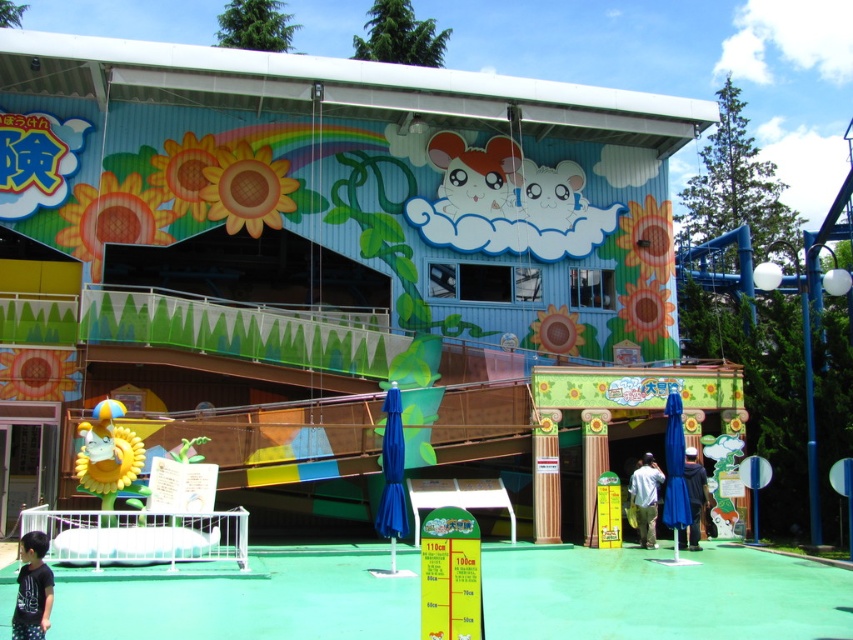
Question: Which point is closer to the camera taking this photo?

Choices:
 (A) click(28, 550)
 (B) click(637, 486)
 (C) click(695, 472)

Answer: (A)

Question: Is white fabric shirt at lower right wider than dark blue fabric jacket at lower center?

Choices:
 (A) yes
 (B) no

Answer: (A)

Question: Which of these objects is positioned closest to the white fabric shirt at lower right?

Choices:
 (A) black cotton shirt at lower left
 (B) dark blue fabric jacket at lower center

Answer: (B)

Question: Which object is closer to the camera taking this photo?

Choices:
 (A) dark blue fabric jacket at lower center
 (B) white fabric shirt at lower right

Answer: (B)

Question: Can you confirm if white fabric shirt at lower right is positioned to the right of dark blue fabric jacket at lower center?

Choices:
 (A) no
 (B) yes

Answer: (A)

Question: Can you confirm if black cotton shirt at lower left is wider than dark blue fabric jacket at lower center?

Choices:
 (A) no
 (B) yes

Answer: (B)